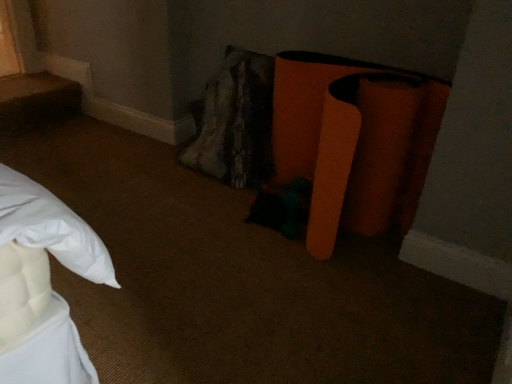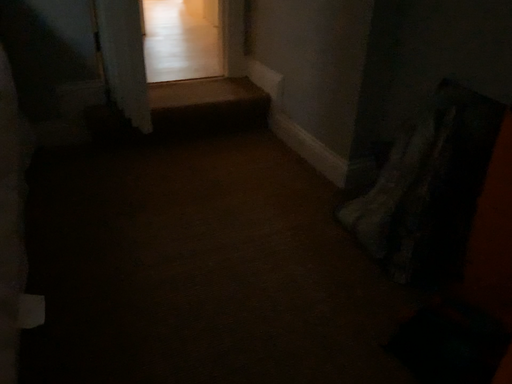
Question: How did the camera likely rotate when shooting the video?

Choices:
 (A) rotated right
 (B) rotated left

Answer: (B)